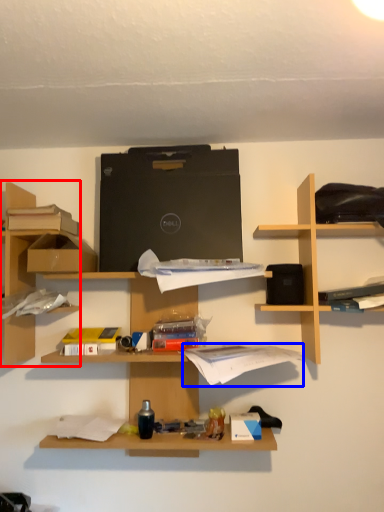
Question: Which object is further to the camera taking this photo, shelf (highlighted by a red box) or book (highlighted by a blue box)?

Choices:
 (A) shelf
 (B) book

Answer: (A)